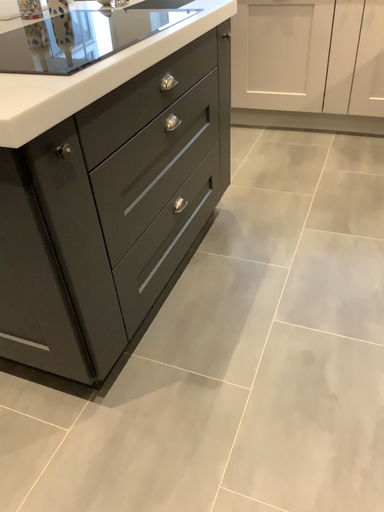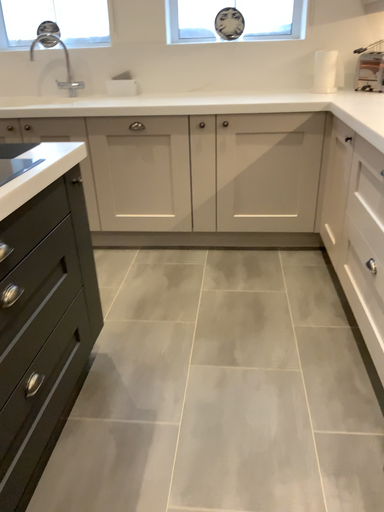
Question: How did the camera likely rotate when shooting the video?

Choices:
 (A) rotated right
 (B) rotated left

Answer: (A)